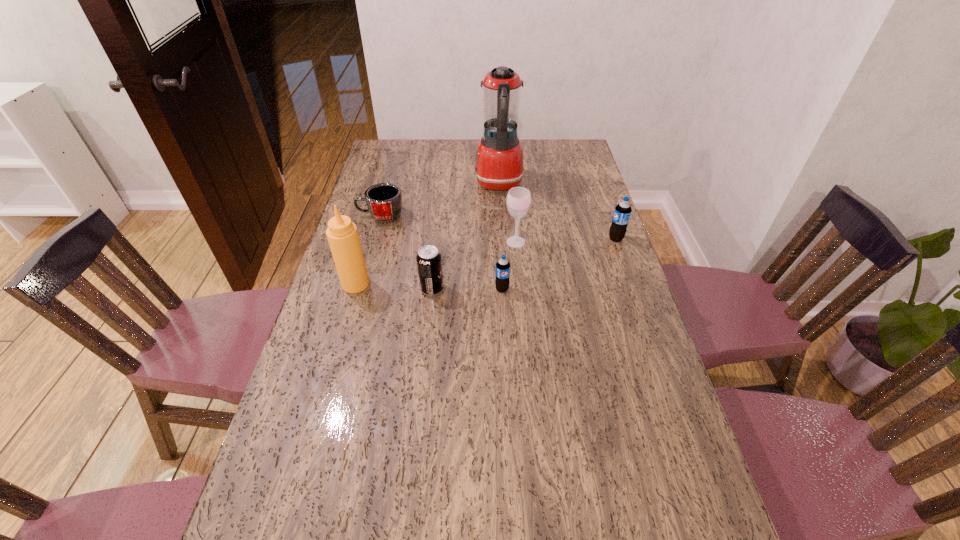
I want to click on the second soda can from left to right, so click(502, 282).

Identify the location of the rightmost object. (622, 212).

Find the location of a particular element. This screenshot has height=540, width=960. the farthest soda can is located at coordinates (622, 212).

You are a GUI agent. You are given a task and a screenshot of the screen. Output one action in this format:
    pyautogui.click(x=<x>, y=<y>)
    Task: Click on the tallest object
    The height and width of the screenshot is (540, 960).
    Given the screenshot: What is the action you would take?
    pyautogui.click(x=499, y=165)

I want to click on food processor, so click(499, 165).

Locate an element on the screen. The width and height of the screenshot is (960, 540). the sixth shortest object is located at coordinates (342, 233).

At what (x,y) coordinates should I click in order to perform the action: click on the shortest object. Please return your answer as a coordinate pair (x, y). Looking at the image, I should click on (384, 200).

You are a GUI agent. You are given a task and a screenshot of the screen. Output one action in this format:
    pyautogui.click(x=<x>, y=<y>)
    Task: Click on the second farthest object
    
    Given the screenshot: What is the action you would take?
    pyautogui.click(x=384, y=200)

Identify the location of the fifth object from right to left. This screenshot has height=540, width=960. [429, 262].

Find the location of a particular element. wineglass is located at coordinates (518, 201).